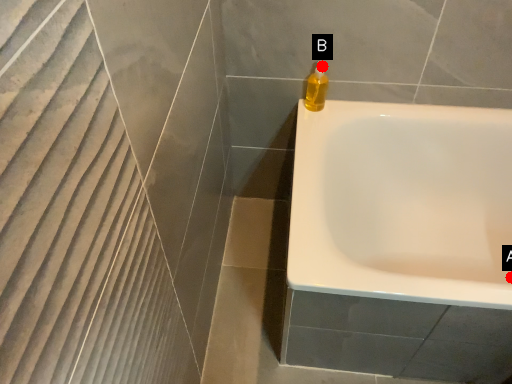
Question: Two points are circled on the image, labeled by A and B beside each circle. Which of the following is the farthest from the observer?

Choices:
 (A) A is further
 (B) B is further

Answer: (A)